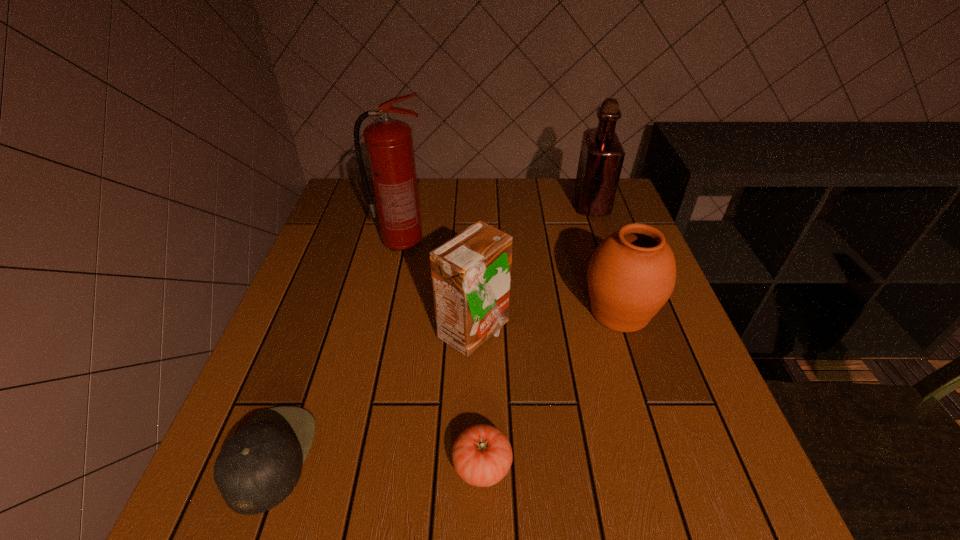
Point out which object is positioned as the fifth nearest to the fifth shortest object. Please provide its 2D coordinates. Your answer should be formatted as a tuple, i.e. [(x, y)], where the tuple contains the x and y coordinates of a point satisfying the conditions above.

[(256, 469)]

You are a GUI agent. You are given a task and a screenshot of the screen. Output one action in this format:
    pyautogui.click(x=<x>, y=<y>)
    Task: Click on the vacant area that satisfies the following two spatial constraints: 1. on the brim of the leftmost object; 2. on the left side of the shortest object
    This screenshot has height=540, width=960.
    Given the screenshot: What is the action you would take?
    pyautogui.click(x=268, y=465)

I want to click on vacant space that satisfies the following two spatial constraints: 1. on the back side of the urn; 2. on the handle side the tallest object, so 598,244.

Where is `vacant space that satisfies the following two spatial constraints: 1. on the straw side of the carton; 2. on the right side of the tomato`? The height and width of the screenshot is (540, 960). vacant space that satisfies the following two spatial constraints: 1. on the straw side of the carton; 2. on the right side of the tomato is located at coordinates (471, 465).

I want to click on free location that satisfies the following two spatial constraints: 1. on the back side of the shortest object; 2. on the handle side the fifth object from right to left, so click(481, 244).

You are a GUI agent. You are given a task and a screenshot of the screen. Output one action in this format:
    pyautogui.click(x=<x>, y=<y>)
    Task: Click on the free space that satisfies the following two spatial constraints: 1. on the back side of the shortest object; 2. on the brim of the fifth tallest object
    The height and width of the screenshot is (540, 960).
    Given the screenshot: What is the action you would take?
    (482, 457)

Locate an element on the screen. The height and width of the screenshot is (540, 960). free region that satisfies the following two spatial constraints: 1. on the back side of the tomato; 2. on the straw side of the carton is located at coordinates (482, 332).

At what (x,y) coordinates should I click in order to perform the action: click on blank area in the image that satisfies the following two spatial constraints: 1. on the back side of the farthest object; 2. on the left side of the urn. Please return your answer as a coordinate pair (x, y). This screenshot has width=960, height=540. Looking at the image, I should click on (586, 205).

Where is `vacant space that satisfies the following two spatial constraints: 1. on the handle side the fire extinguisher; 2. on the right side of the tomato`? The width and height of the screenshot is (960, 540). vacant space that satisfies the following two spatial constraints: 1. on the handle side the fire extinguisher; 2. on the right side of the tomato is located at coordinates (354, 465).

Identify the location of vacant space that satisfies the following two spatial constraints: 1. on the handle side the fire extinguisher; 2. on the back side of the urn. The image size is (960, 540). (388, 312).